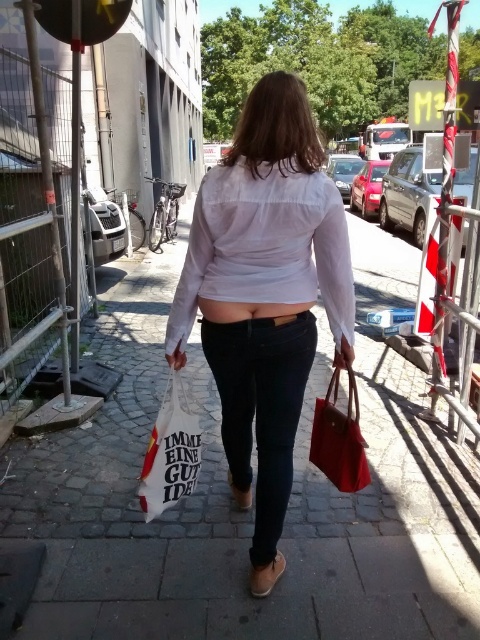
Consider the image. You are a photographer trying to capture the person in the image. The person is wearing black denim jeans at center. If you want to focus on their jeans, which part of the image should you aim your camera at?

You should aim your camera at point (261, 408) to focus on the black denim jeans at center, as that is their exact position in the image.

You are a photographer trying to capture the person walking away. You want to ensure both the black denim jeans at center and the brown suede sandal at lower center are in focus. Given that your camera can only focus on objects within a 45 cm range, will both items be in focus?

The black denim jeans at center is 47.24 centimeters away from the brown suede sandal at lower center. Since the distance between them exceeds the camera focus range of 45 cm, the camera might not be able to keep both in focus simultaneously.